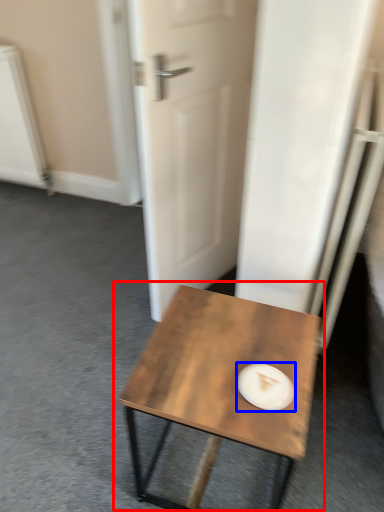
Question: Which point is closer to the camera, coffee table (highlighted by a red box) or paper plate (highlighted by a blue box)?

Choices:
 (A) coffee table
 (B) paper plate

Answer: (A)